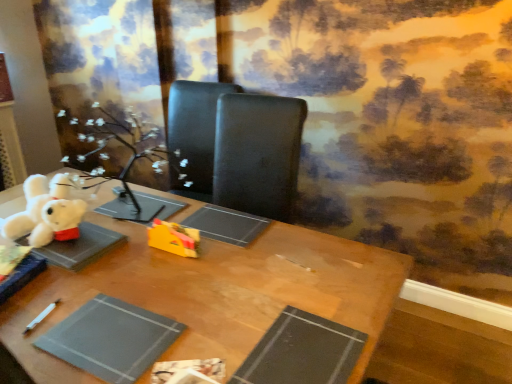
At what (x,y) coordinates should I click in order to perform the action: click on empty space that is in between gray matte paper at lower left, which ranks as the 2th paperback book in right-to-left order, and white plush bear at upper left, arranged as the 1th toy when viewed from the left. Please return your answer as a coordinate pair (x, y). The height and width of the screenshot is (384, 512). Looking at the image, I should click on (83, 288).